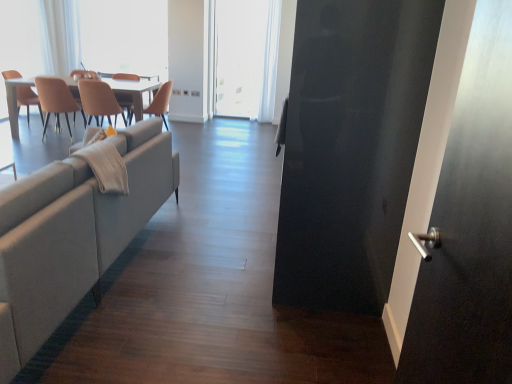
At what (x,y) coordinates should I click in order to perform the action: click on vacant space positioned to the left of glossy black screen door at right. Please return your answer as a coordinate pair (x, y). Looking at the image, I should click on (217, 280).